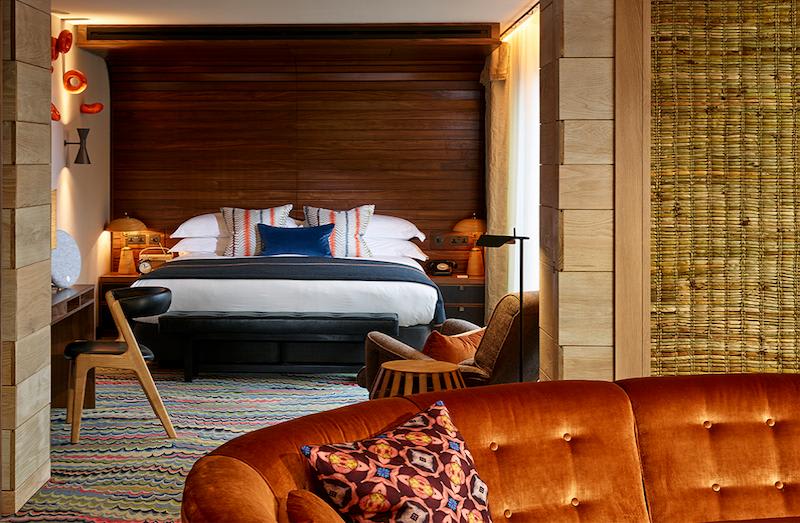
Image resolution: width=800 pixels, height=523 pixels. In order to click on lamp in this screenshot , I will do `click(493, 243)`.